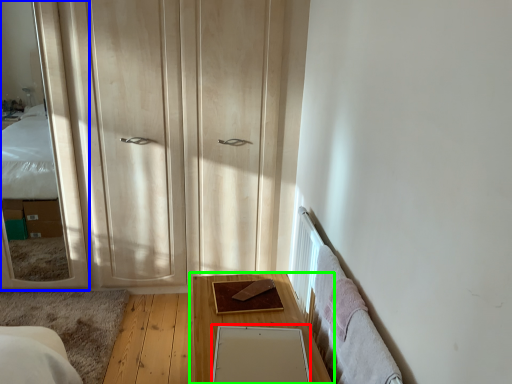
Question: Which is nearer to the mirror (highlighted by a red box)? mirror (highlighted by a blue box) or table (highlighted by a green box).

Choices:
 (A) mirror
 (B) table

Answer: (B)